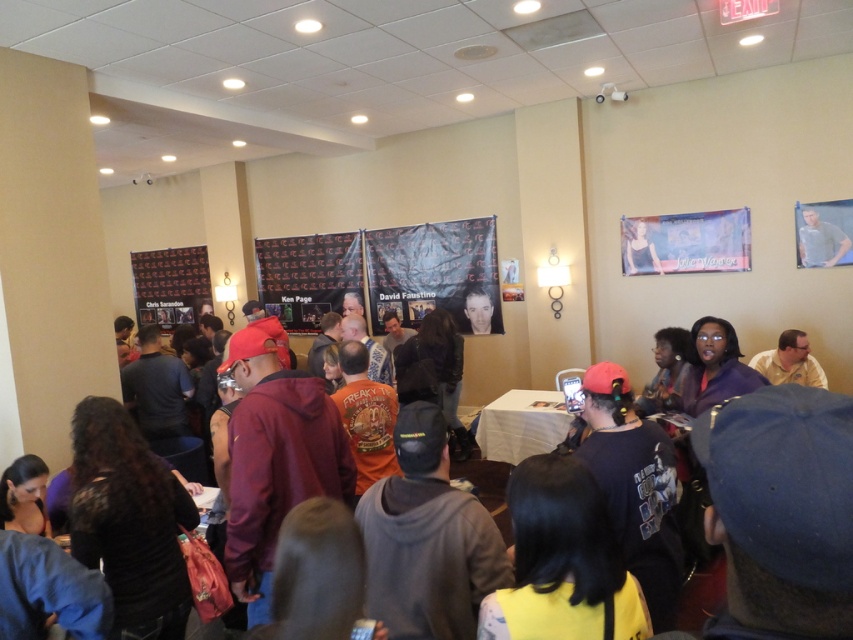
Looking at this image, can you confirm if dark red hoodie at center is positioned below white cloth-covered table at center?

Incorrect, dark red hoodie at center is not positioned below white cloth-covered table at center.

Which of these two, dark red hoodie at center or white cloth-covered table at center, stands shorter?

With less height is dark red hoodie at center.

This screenshot has height=640, width=853. Describe the element at coordinates (780, 509) in the screenshot. I see `dark red hoodie at center` at that location.

At what (x,y) coordinates should I click in order to perform the action: click on dark red hoodie at center. Please return your answer as a coordinate pair (x, y). The width and height of the screenshot is (853, 640). Looking at the image, I should click on (780, 509).